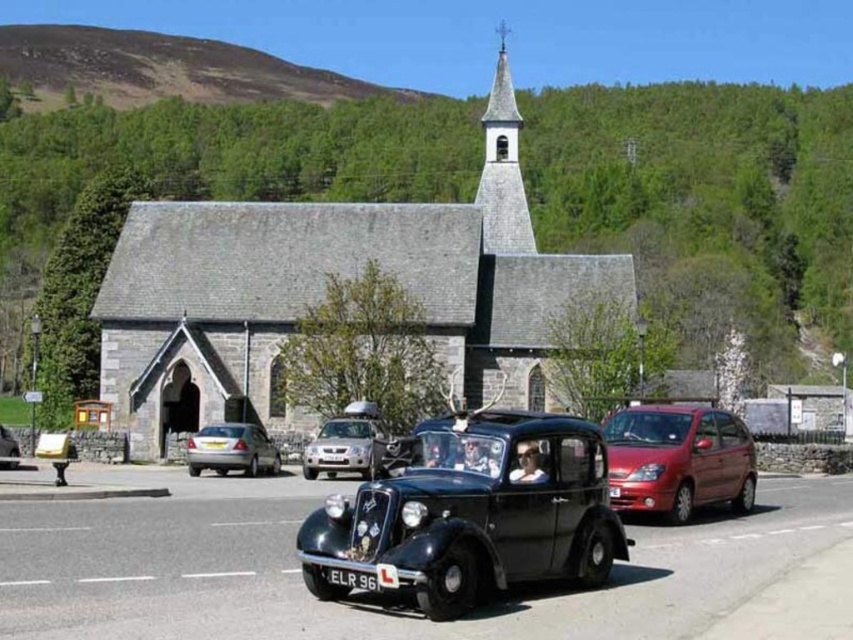
Question: Does shiny black car at center appear on the left side of silver metallic car at center?

Choices:
 (A) no
 (B) yes

Answer: (A)

Question: Estimate the real-world distances between objects in this image. Which object is farther from the shiny black car at center?

Choices:
 (A) smooth gray steeple at upper center
 (B) metallic silver car at center
 (C) silver metallic sedan at center
 (D) gray stone church at center

Answer: (A)

Question: Observing the image, what is the correct spatial positioning of shiny black car at center in reference to silver metallic sedan at center?

Choices:
 (A) below
 (B) above

Answer: (B)

Question: Which point is closer to the camera taking this photo?

Choices:
 (A) (373, 412)
 (B) (0, 438)

Answer: (B)

Question: Which point is farther to the camera?

Choices:
 (A) (526, 253)
 (B) (314, 477)

Answer: (A)

Question: Is shiny black car at center closer to the viewer compared to silver metallic car at center?

Choices:
 (A) no
 (B) yes

Answer: (B)